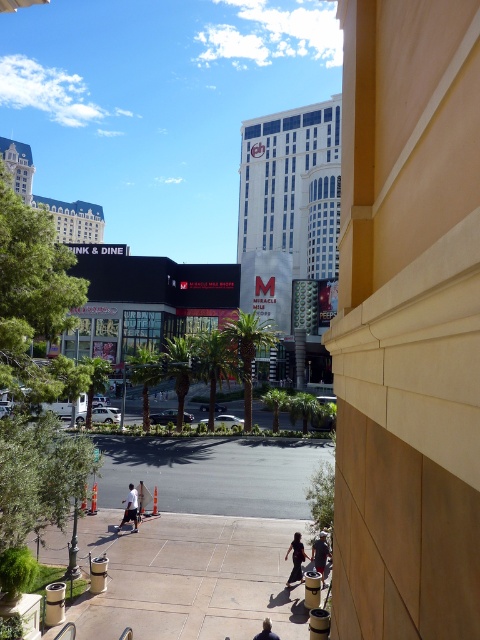
Is beige stone building at center below denim pants at lower right?

Incorrect, beige stone building at center is not positioned below denim pants at lower right.

The height and width of the screenshot is (640, 480). What do you see at coordinates (408, 323) in the screenshot? I see `beige stone building at center` at bounding box center [408, 323].

Does point (477, 56) come farther from viewer compared to point (325, 552)?

No, it is in front of (325, 552).

Identify the location of beige stone building at center. (408, 323).

Which is behind, point (296, 554) or point (129, 496)?

The point (129, 496) is more distant.

Is point (298, 563) in front of point (133, 509)?

That is True.

The height and width of the screenshot is (640, 480). I want to click on dark blue jeans at lower center, so click(x=296, y=557).

The width and height of the screenshot is (480, 640). In order to click on dark blue jeans at lower center in this screenshot , I will do `click(296, 557)`.

Is denim pants at lower right positioned in front of blonde hair at lower center?

That is False.

Locate an element on the screen. This screenshot has width=480, height=640. denim pants at lower right is located at coordinates (321, 554).